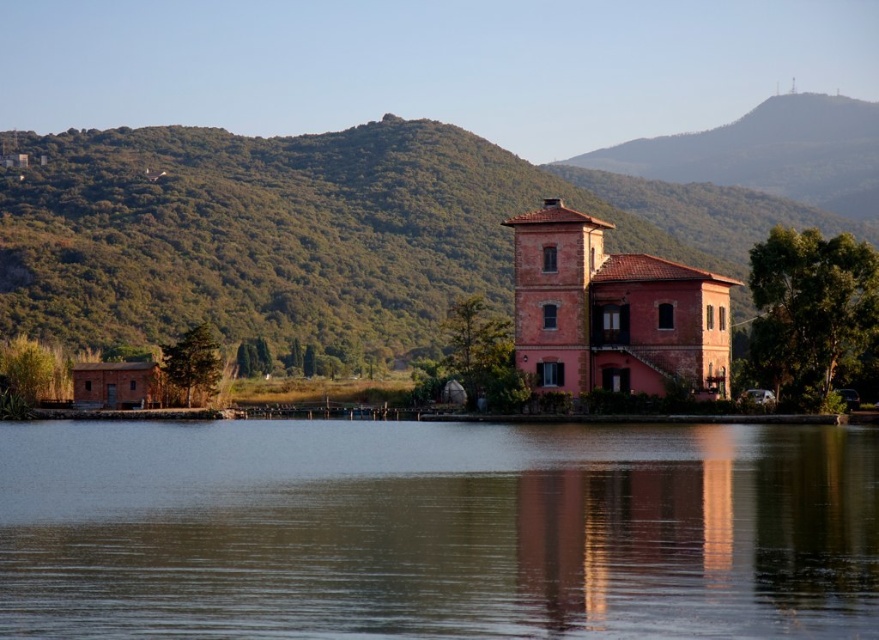
You are standing at the point with coordinates point (69,588) and want to walk to the point with coordinates point (122,131). Based on the scene description, will you have an unobstructed path between these two points?

The point (69,588) is in front of point (122,131), so there is an unobstructed path between them. You can walk directly from point (69,588) to point (122,131) without any obstacles in between.

You are standing in the lakeside area and want to take a photo of both the green textured hillside at upper left and the matte brick house at center. Which object should you adjust your camera focus on first to ensure both are in the frame?

You should focus on the matte brick house at center first because the green textured hillside at upper left is closer to you, so adjusting focus starting from the closer object ensures both are in the frame.

You are standing at the lakeside and want to take a photo of the matte brick house at center and the smooth water at center. Which object should you focus on first if you want to capture both in your shot without moving the camera?

You should focus on the matte brick house at center first because it is above the smooth water at center, so adjusting the camera to include both would require framing from the top down.